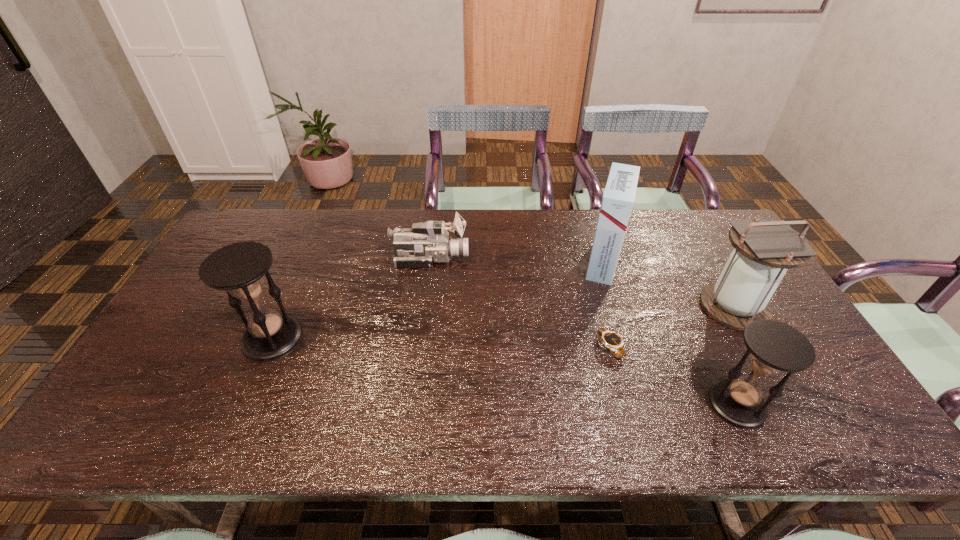
What are the coordinates of `the taller hourglass` in the screenshot? It's located at click(239, 268).

This screenshot has height=540, width=960. Find the location of `the leftmost object`. the leftmost object is located at coordinates (239, 268).

I want to click on the right hourglass, so click(x=773, y=347).

Identify the location of the shorter hourglass. (773, 347).

Locate an element on the screen. This screenshot has width=960, height=540. cigarette case is located at coordinates (618, 199).

The height and width of the screenshot is (540, 960). In order to click on the fifth tallest object in this screenshot , I will do `click(428, 242)`.

Locate an element on the screen. Image resolution: width=960 pixels, height=540 pixels. the fifth object from right to left is located at coordinates (428, 242).

I want to click on the shortest object, so click(613, 341).

Locate an element on the screen. The width and height of the screenshot is (960, 540). lantern is located at coordinates (764, 249).

Locate an element on the screen. blank area located 0.150m on the left of the taller hourglass is located at coordinates (187, 339).